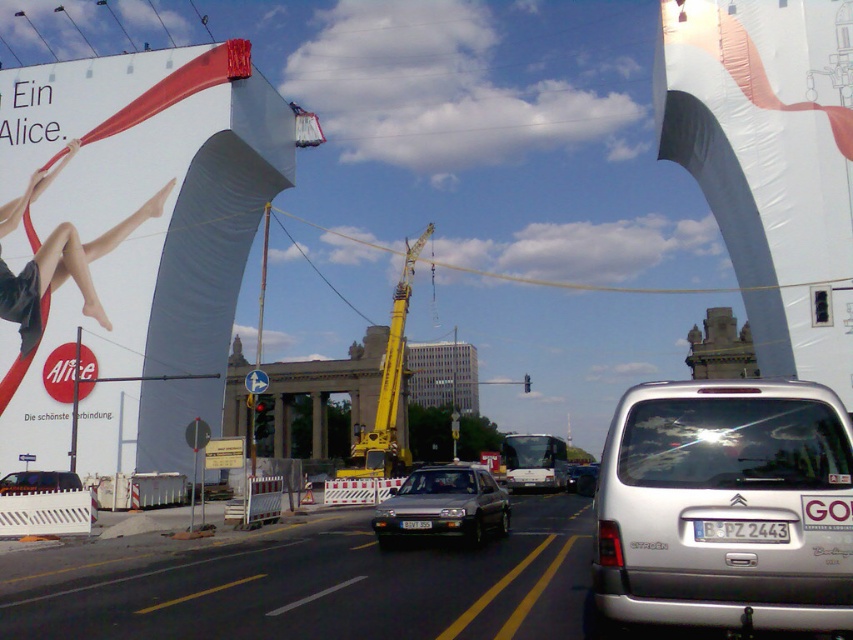
Question: Which object is closer to the camera taking this photo?

Choices:
 (A) matte black van at center
 (B) satin silver sedan at center

Answer: (B)

Question: Which of the following is the closest to the observer?

Choices:
 (A) (32, 474)
 (B) (543, 467)
 (C) (573, 488)

Answer: (A)

Question: From the image, what is the correct spatial relationship of matte white fabric at upper left in relation to satin silver sedan at center?

Choices:
 (A) below
 (B) above

Answer: (B)

Question: Observing the image, what is the correct spatial positioning of white plastic license plate at center in reference to silver metallic sedan at center?

Choices:
 (A) left
 (B) right

Answer: (A)

Question: Which object is closer to the camera taking this photo?

Choices:
 (A) white matte van at center
 (B) silver metallic sedan at center
 (C) yellow metallic crane at center

Answer: (B)

Question: Does matte white fabric at upper left appear under matte black van at center?

Choices:
 (A) yes
 (B) no

Answer: (B)